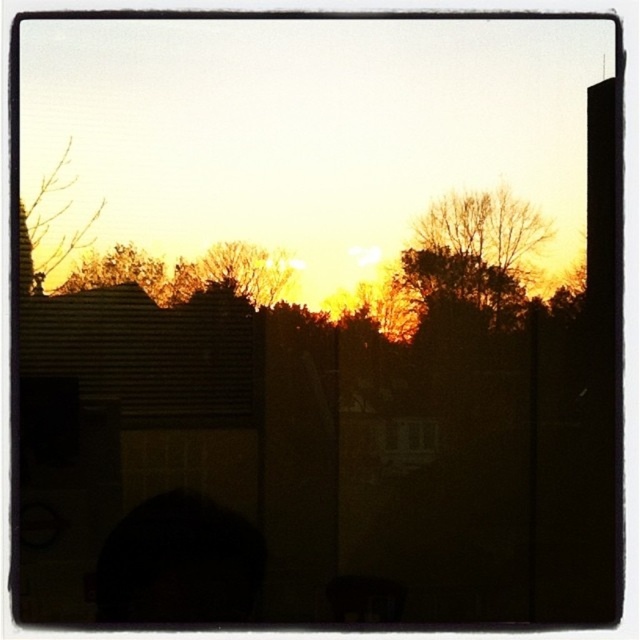
Is bare branches at upper left closer to the viewer compared to brown textured tree at upper left?

Yes.

Does point (72, 246) come in front of point (77, 266)?

Yes, point (72, 246) is closer to viewer.

Does point (65, 236) lie behind point (77, 269)?

No.

At what (x,y) coordinates should I click in order to perform the action: click on bare branches at upper left. Please return your answer as a coordinate pair (x, y). The height and width of the screenshot is (640, 640). Looking at the image, I should click on (51, 227).

Does bare branches at upper left have a lesser height compared to orange-brown textured tree at center?

Incorrect, bare branches at upper left's height does not fall short of orange-brown textured tree at center's.

Measure the distance between point (26, 280) and camera.

→ Point (26, 280) and camera are 5.67 feet apart.

The image size is (640, 640). In order to click on bare branches at upper left in this screenshot , I will do click(x=51, y=227).

Can you confirm if orange-brown textured tree at center is wider than brown textured tree at upper left?

Yes, orange-brown textured tree at center is wider than brown textured tree at upper left.

Can you confirm if orange-brown textured tree at center is bigger than brown textured tree at upper left?

No, orange-brown textured tree at center is not bigger than brown textured tree at upper left.

The height and width of the screenshot is (640, 640). In order to click on orange-brown textured tree at center in this screenshot , I will do `click(236, 273)`.